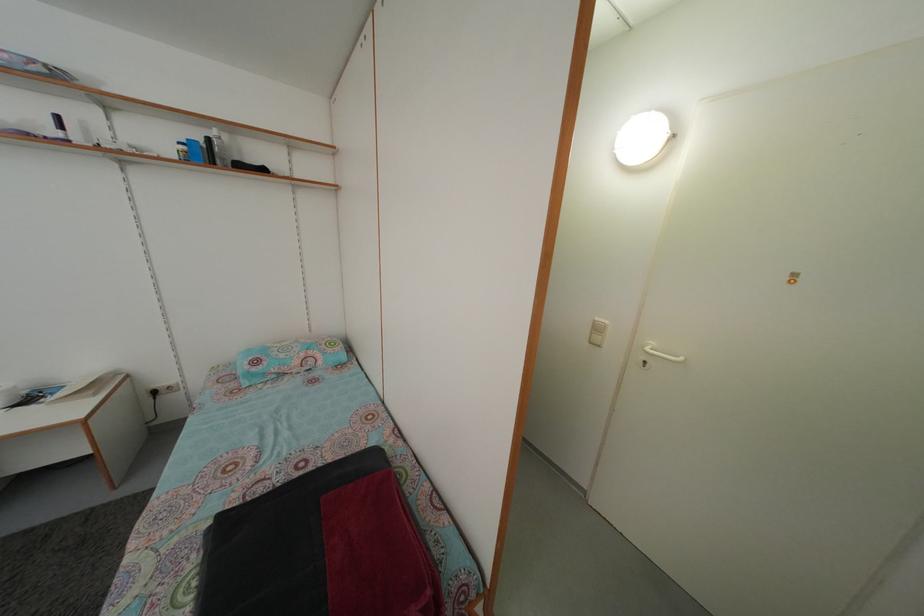
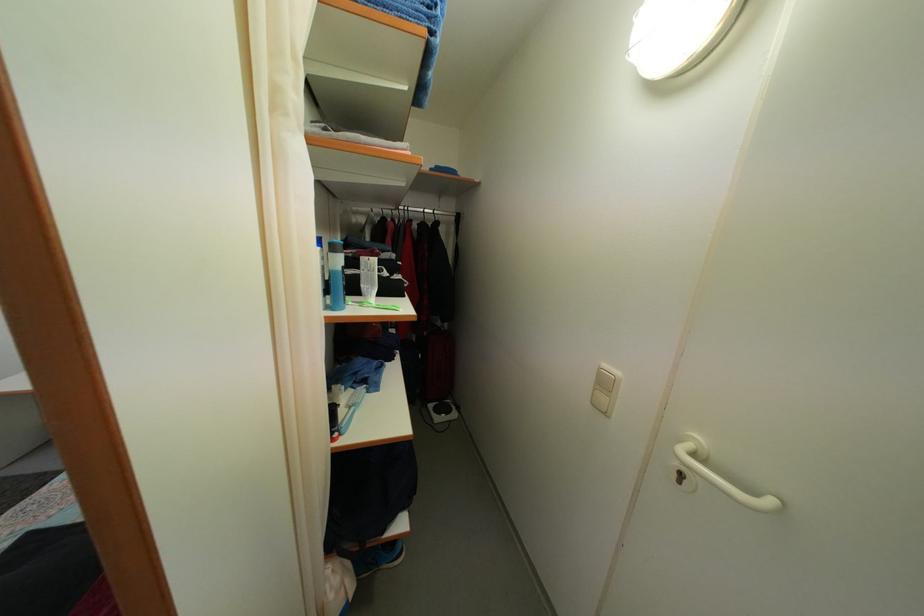
What movement of the cameraman would produce the second image?

The movement direction of the cameraman is right, forward.